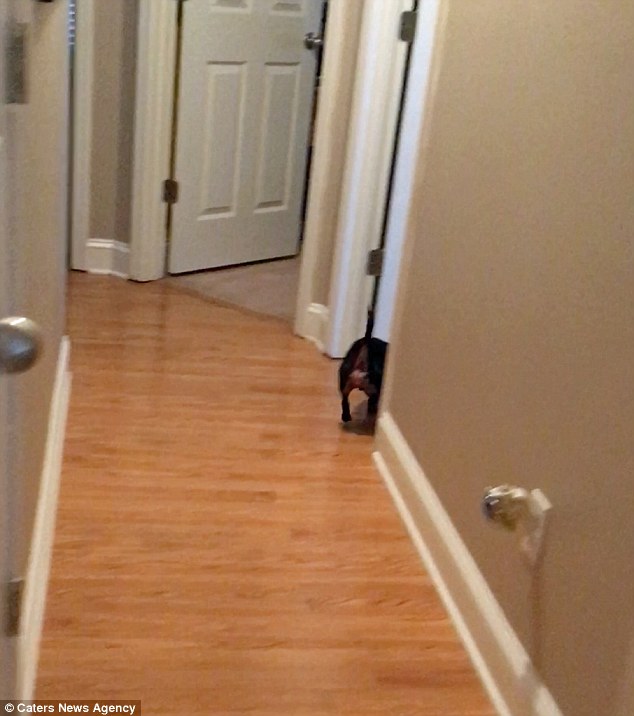
The image size is (634, 716). I want to click on side wall, so [525, 289], [36, 415].